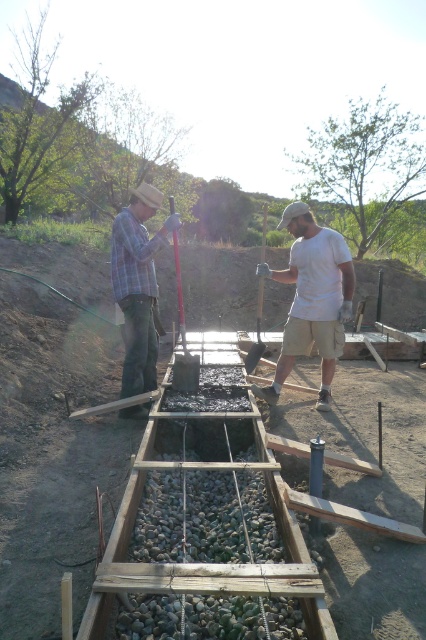
You are a construction supervisor checking the site. You notice the white matte shirt at center and the metallic shovel at center. Which object is closer to you?

The white matte shirt at center is closer to you because it is in front of the metallic shovel at center.

Based on the scene description, where is the matte black concrete at center located in the image?

The matte black concrete at center is located at point (313, 298) in the image.

You are a construction inspector standing at the camera position. You need to check the matte black concrete at center. Can you reach it without moving from your current position if your maximum reach is 5 meters?

The matte black concrete at center is 4.86 meters away from the camera, so yes, you can reach it since your maximum reach is 5 meters.